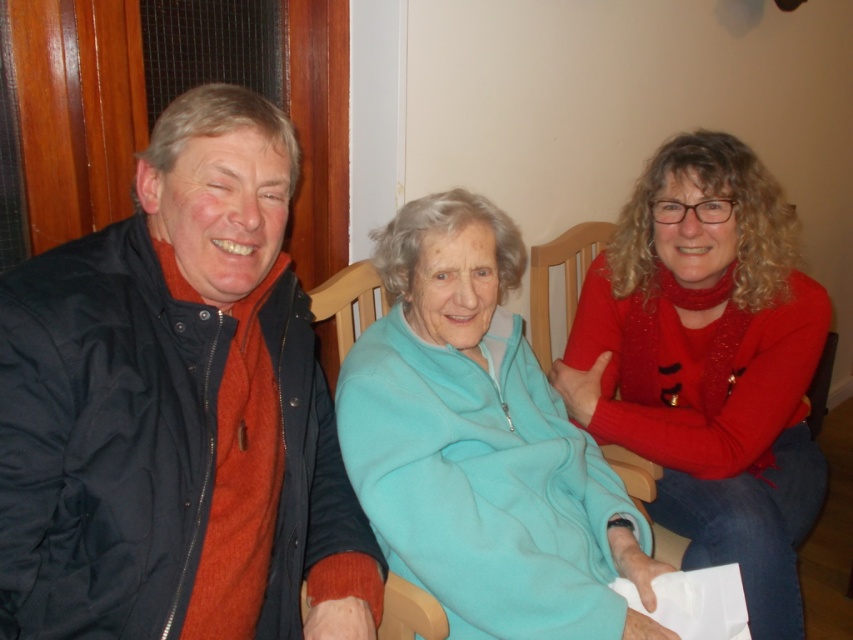
Is matte black jacket at left bigger than teal fleece blanket at center?

Actually, matte black jacket at left might be smaller than teal fleece blanket at center.

Is point (294, 596) less distant than point (549, 572)?

Yes, point (294, 596) is in front of point (549, 572).

The width and height of the screenshot is (853, 640). I want to click on matte black jacket at left, so click(177, 410).

Measure the distance from teal fleece blanket at center to wooden chair at center.

teal fleece blanket at center is 46.56 centimeters away from wooden chair at center.

Is teal fleece blanket at center in front of wooden chair at center?

Yes, teal fleece blanket at center is closer to the viewer.

This screenshot has height=640, width=853. Describe the element at coordinates (480, 444) in the screenshot. I see `teal fleece blanket at center` at that location.

Identify the location of teal fleece blanket at center. The image size is (853, 640). (480, 444).

From the picture: Between matte black jacket at left and wooden chair at center, which one is positioned higher?

wooden chair at center

This screenshot has width=853, height=640. I want to click on matte black jacket at left, so click(177, 410).

I want to click on matte black jacket at left, so click(177, 410).